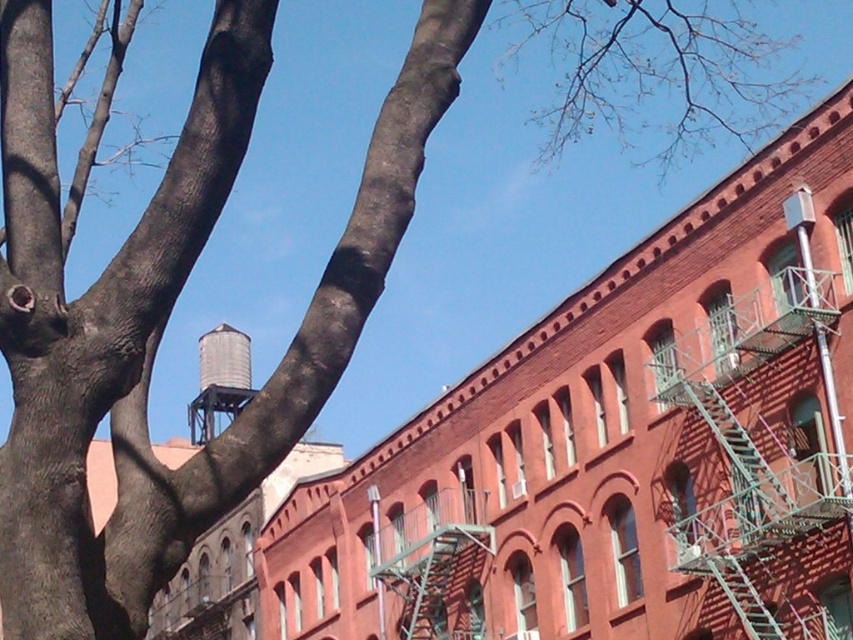
Question: Among these objects, which one is nearest to the camera?

Choices:
 (A) green metal fire escape at center
 (B) metallic silver fire escape at right

Answer: (B)

Question: Is metallic silver fire escape at right closer to camera compared to green metal fire escape at center?

Choices:
 (A) yes
 (B) no

Answer: (A)

Question: Which object is farther from the camera taking this photo?

Choices:
 (A) metallic silver fire escape at right
 (B) metallic silver water tower at center left

Answer: (B)

Question: Is the position of green metal fire escape at center less distant than that of metallic silver water tower at center left?

Choices:
 (A) yes
 (B) no

Answer: (A)

Question: Which of the following is the farthest from the observer?

Choices:
 (A) metallic silver fire escape at right
 (B) green metal fire escape at center
 (C) metallic silver water tower at center left

Answer: (C)

Question: Is metallic silver fire escape at right to the right of metallic silver water tower at center left from the viewer's perspective?

Choices:
 (A) no
 (B) yes

Answer: (B)